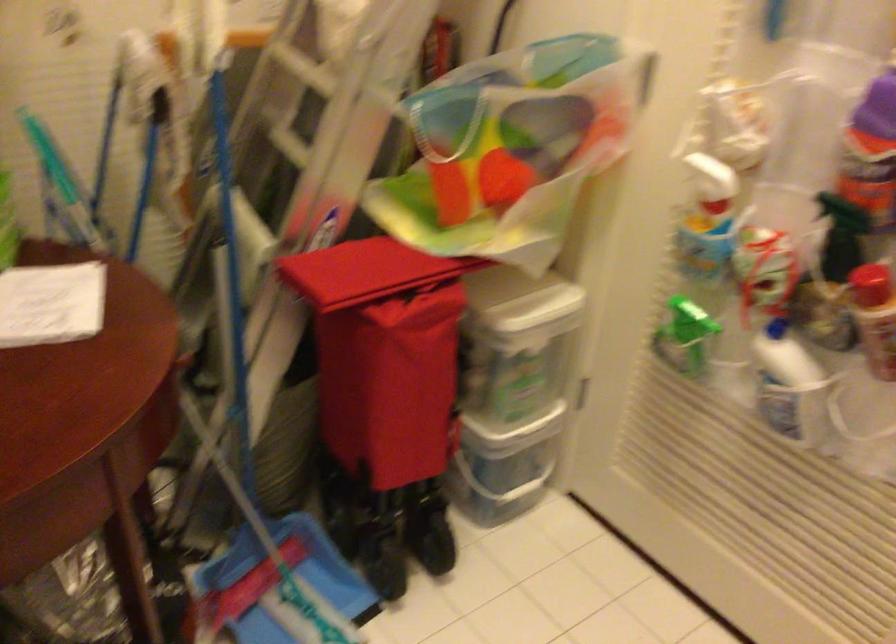
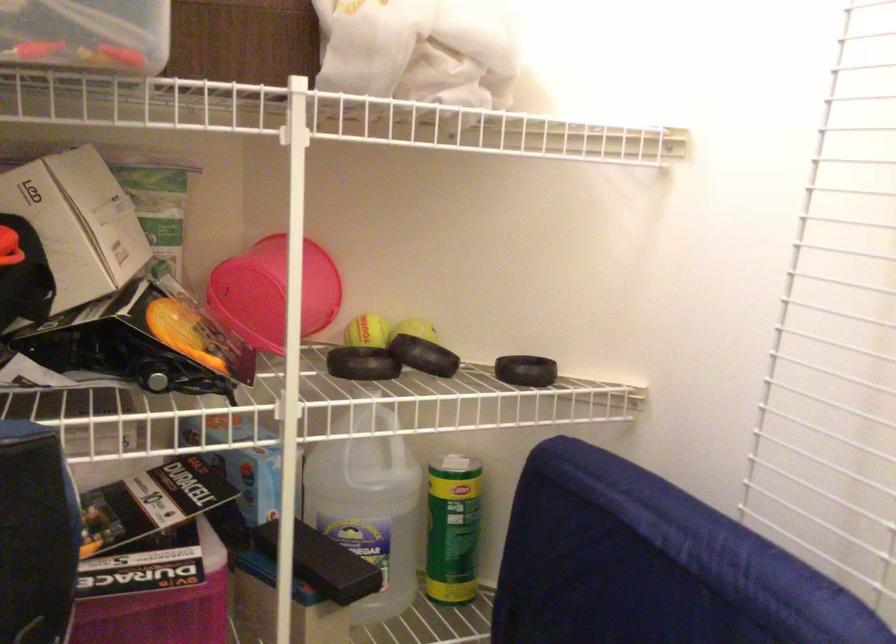
Question: The first image is from the beginning of the video and the second image is from the end. How did the camera likely rotate when shooting the video?

Choices:
 (A) Left
 (B) Right
 (C) Up
 (D) Down

Answer: (A)